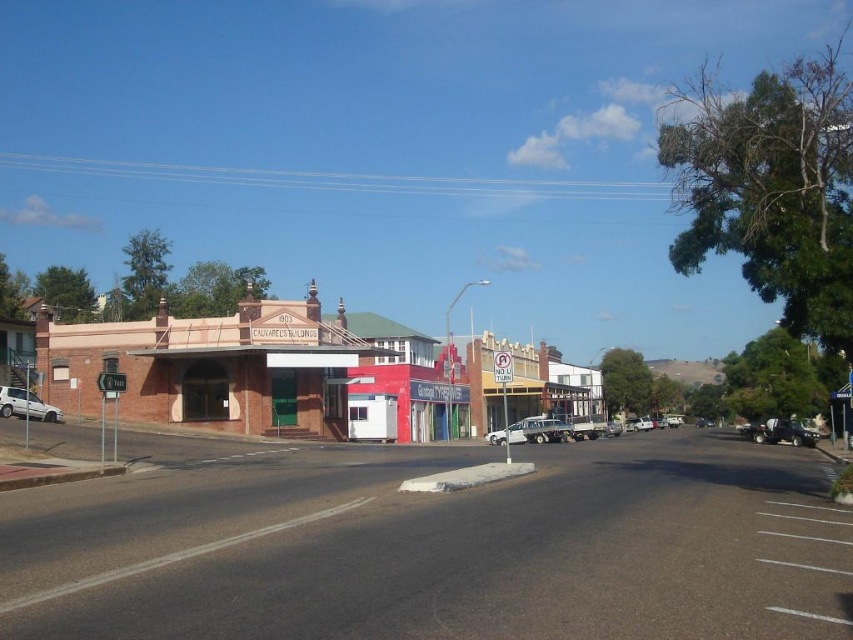
Question: Which is farther from the brick building at center?

Choices:
 (A) white matte car at lower left
 (B) white metallic car at center
 (C) metallic silver sedan at center
 (D) smooth asphalt road at center

Answer: (C)

Question: Is white metallic car at center below metallic silver sedan at center?

Choices:
 (A) yes
 (B) no

Answer: (B)

Question: Based on their relative distances, which object is nearer to the brick building at center?

Choices:
 (A) smooth asphalt road at center
 (B) metallic silver sedan at center
 (C) white matte car at lower left
 (D) white metallic car at center

Answer: (D)

Question: Does white matte car at lower left come in front of metallic silver sedan at center?

Choices:
 (A) yes
 (B) no

Answer: (A)

Question: Which object appears farthest from the camera in this image?

Choices:
 (A) white metallic car at center
 (B) white matte car at lower left
 (C) smooth asphalt road at center

Answer: (A)

Question: Does smooth asphalt road at center appear under white metallic car at center?

Choices:
 (A) yes
 (B) no

Answer: (B)